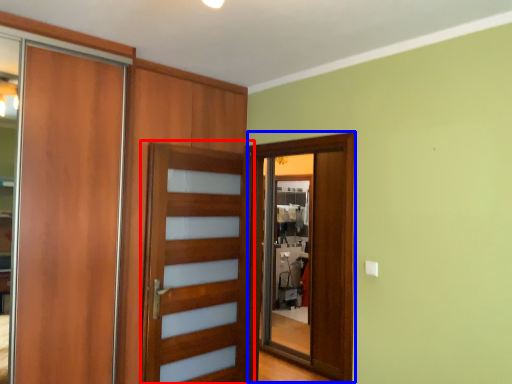
Question: Which object appears closest to the camera in this image, screen door (highlighted by a red box) or screen door (highlighted by a blue box)?

Choices:
 (A) screen door
 (B) screen door

Answer: (A)